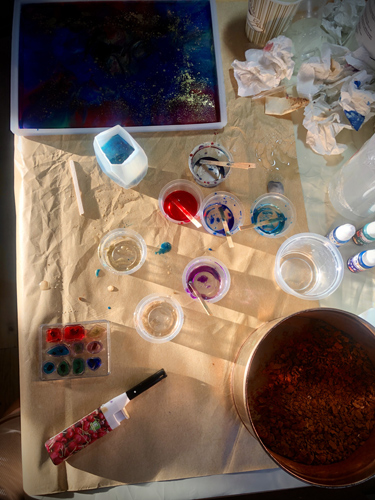
This screenshot has width=375, height=500. I want to click on plastic cups, so tap(278, 230), tap(208, 271), tap(129, 250), tap(156, 309), tap(216, 217), tap(188, 209), tap(205, 152), tap(302, 270), tap(350, 197).